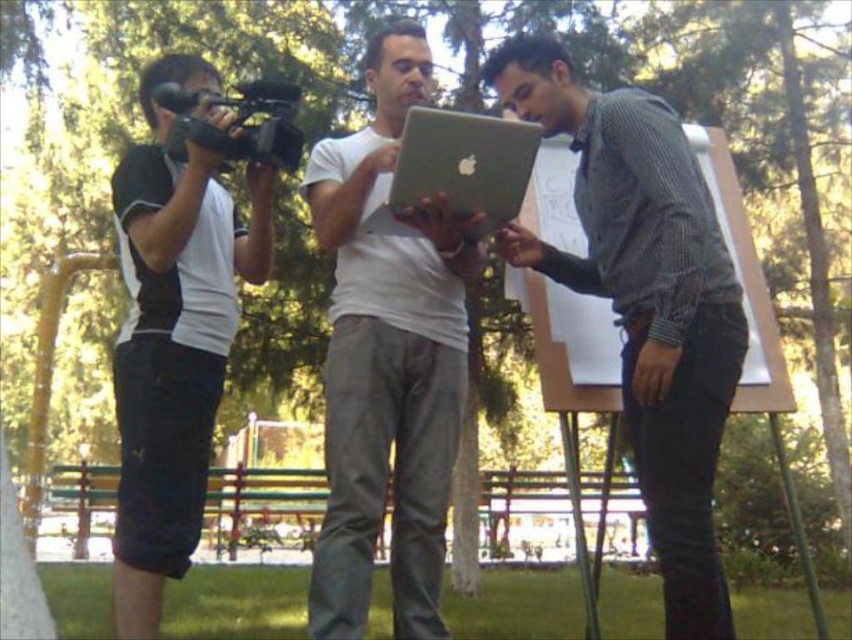
Is matte gray laptop at right thinner than black plastic video camera at left?

In fact, matte gray laptop at right might be wider than black plastic video camera at left.

Which of these two, matte gray laptop at right or black plastic video camera at left, stands taller?

With more height is matte gray laptop at right.

Who is more distant from viewer, (x=694, y=177) or (x=252, y=81)?

The point (x=252, y=81) is behind.

Locate an element on the screen. This screenshot has width=852, height=640. matte gray laptop at right is located at coordinates (645, 301).

Does matte gray laptop at right have a greater width compared to black fabric camera at left?

Yes.

How much distance is there between matte gray laptop at right and black fabric camera at left?

matte gray laptop at right and black fabric camera at left are 3.32 feet apart.

You are a GUI agent. You are given a task and a screenshot of the screen. Output one action in this format:
    pyautogui.click(x=<x>, y=<y>)
    Task: Click on the matte gray laptop at right
    
    Given the screenshot: What is the action you would take?
    pyautogui.click(x=645, y=301)

Is black fabric camera at left positioned before black plastic video camera at left?

Yes, black fabric camera at left is closer to the viewer.

Does black fabric camera at left have a greater height compared to black plastic video camera at left?

Yes, black fabric camera at left is taller than black plastic video camera at left.

Is point (163, 458) positioned in front of point (183, 118)?

Yes, it is.

Locate an element on the screen. This screenshot has width=852, height=640. black fabric camera at left is located at coordinates (173, 339).